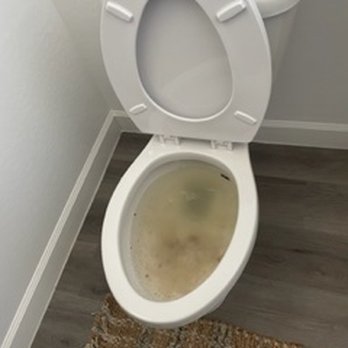
You are a GUI agent. You are given a task and a screenshot of the screen. Output one action in this format:
    pyautogui.click(x=<x>, y=<y>)
    Task: Click on the toilet tank
    The image size is (348, 348).
    Given the screenshot: What is the action you would take?
    pyautogui.click(x=276, y=30)